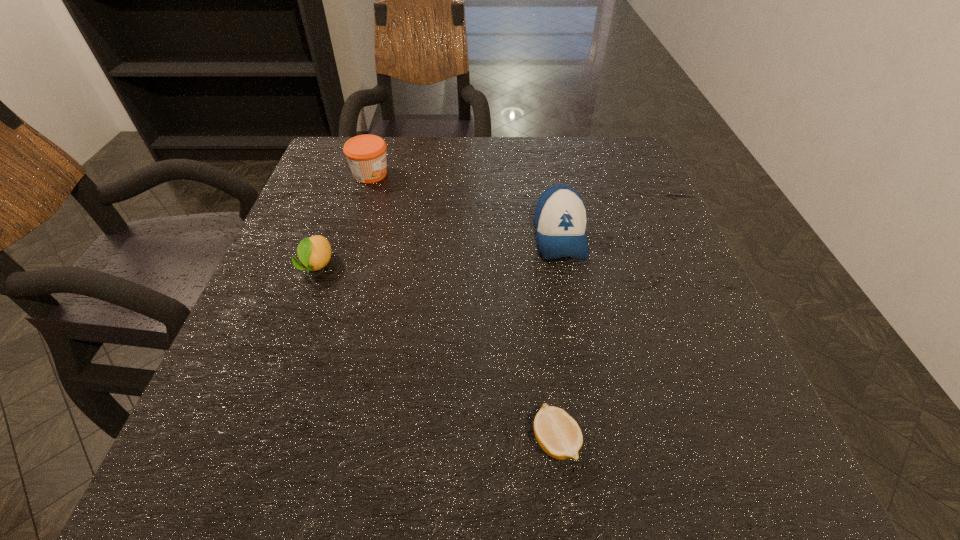
Where is `free space located 0.100m on the right of the right lemon`? This screenshot has width=960, height=540. free space located 0.100m on the right of the right lemon is located at coordinates (650, 441).

Identify the location of object that is at the far edge. click(366, 154).

Locate an element on the screen. The height and width of the screenshot is (540, 960). object that is at the near edge is located at coordinates (558, 434).

This screenshot has height=540, width=960. In order to click on jam present at the left edge in this screenshot , I will do `click(366, 154)`.

Find the location of a particular element. The height and width of the screenshot is (540, 960). lemon that is at the left edge is located at coordinates (314, 253).

Where is `object that is positioned at the far left corner`? The image size is (960, 540). object that is positioned at the far left corner is located at coordinates (366, 154).

Locate an element on the screen. vacant space at the far edge of the desktop is located at coordinates (497, 187).

In the image, there is a desktop. Identify the location of free space at the near edge. Image resolution: width=960 pixels, height=540 pixels. (x=476, y=497).

The width and height of the screenshot is (960, 540). I want to click on blank space at the left edge, so pyautogui.click(x=249, y=416).

Image resolution: width=960 pixels, height=540 pixels. Identify the location of vacant space at the right edge of the desktop. (678, 268).